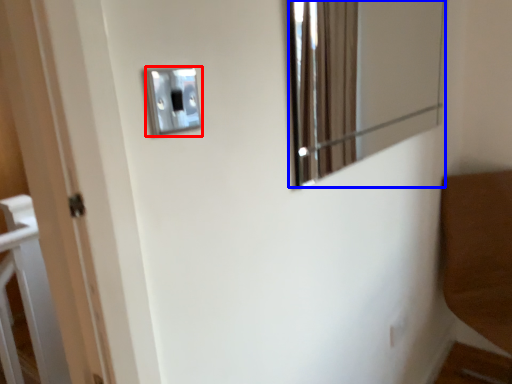
Question: Which object is further to the camera taking this photo, light switch (highlighted by a red box) or mirror (highlighted by a blue box)?

Choices:
 (A) light switch
 (B) mirror

Answer: (B)